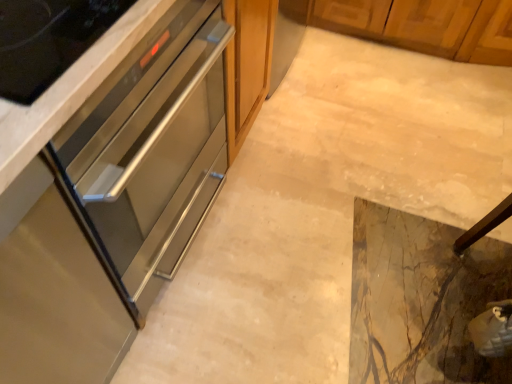
Locate an element on the screen. free space to the right of stainless steel oven at center, acting as the 3th cabinetry starting from the bottom is located at coordinates (302, 137).